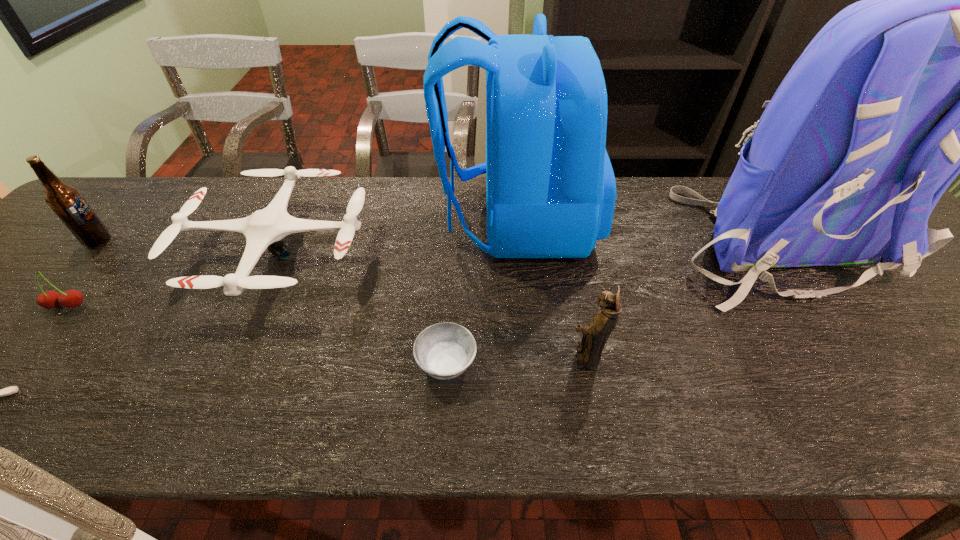
This screenshot has height=540, width=960. Identify the location of empty location between the right backpack and the third tallest object. (437, 241).

The image size is (960, 540). Identify the location of vacant region between the shorter backpack and the seventh tallest object. (481, 292).

Find the location of a particular element. vacant space that is in between the cherry and the left backpack is located at coordinates (292, 264).

Where is `object that is the nearest to the drone`? The height and width of the screenshot is (540, 960). object that is the nearest to the drone is located at coordinates click(x=72, y=298).

The width and height of the screenshot is (960, 540). I want to click on object that can be found as the seventh closest to the drone, so click(x=959, y=58).

The height and width of the screenshot is (540, 960). What are the coordinates of `vacant space that satisfies the following two spatial constraints: 1. with the camera attached at the bottom of the seventh tallest object; 2. on the left side of the drone` in the screenshot? It's located at (227, 363).